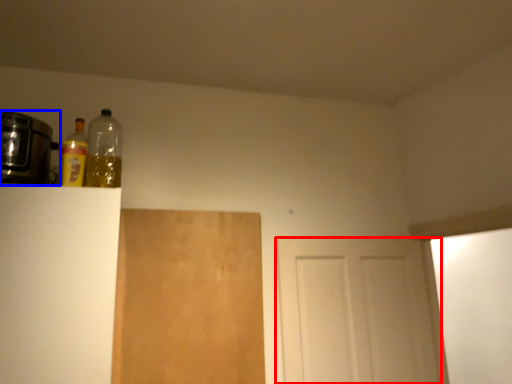
Question: Among these objects, which one is nearest to the camera, door (highlighted by a red box) or appliance (highlighted by a blue box)?

Choices:
 (A) door
 (B) appliance

Answer: (B)